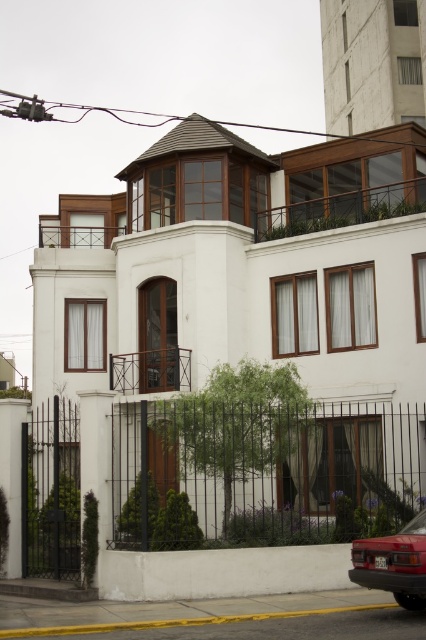
Question: Does black wrought iron fence at lower left have a smaller size compared to matte red car at lower right?

Choices:
 (A) yes
 (B) no

Answer: (B)

Question: Is the position of black wrought iron fence at lower left more distant than that of matte red car at lower right?

Choices:
 (A) no
 (B) yes

Answer: (B)

Question: Which point appears closest to the camera in this image?

Choices:
 (A) (x=351, y=557)
 (B) (x=68, y=428)

Answer: (A)

Question: Which point appears farthest from the camera in this image?

Choices:
 (A) (37, 460)
 (B) (405, 552)

Answer: (A)

Question: Does black wrought iron fence at lower left lie in front of matte red car at lower right?

Choices:
 (A) yes
 (B) no

Answer: (B)